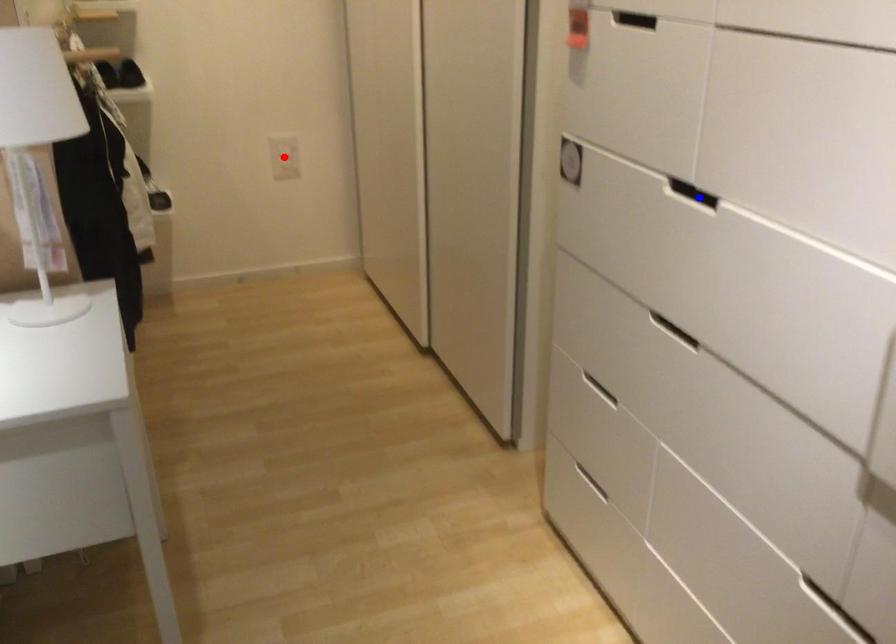
Question: Which of the two points in the image is closer to the camera?

Choices:
 (A) Blue point is closer.
 (B) Red point is closer.

Answer: (A)